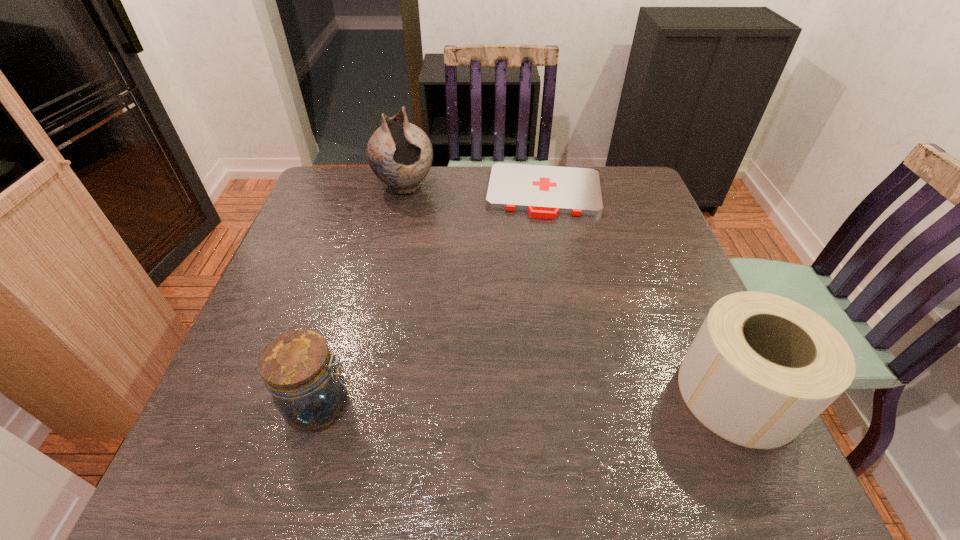
The width and height of the screenshot is (960, 540). Identify the location of vacant spot on the desktop that is between the jar and the rightmost object and is positioned from the spout of the pottery. (504, 400).

This screenshot has width=960, height=540. What are the coordinates of `vacant space on the desktop that is between the jar and the rightmost object and is positioned on handle side the shortest object` in the screenshot? It's located at (538, 399).